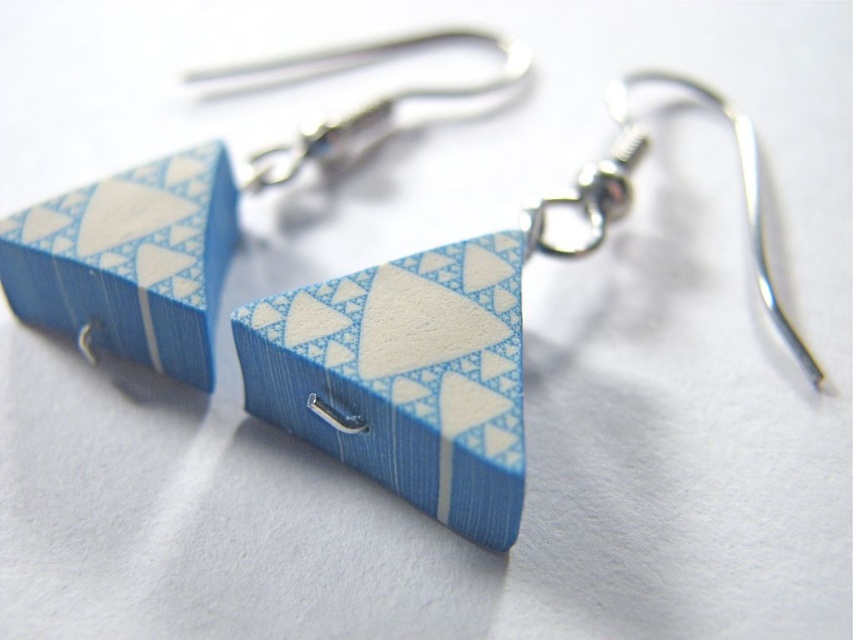
Is matte blue wood triangle at center bigger than blue paper triangle at center?

Indeed, matte blue wood triangle at center has a larger size compared to blue paper triangle at center.

Does matte blue wood triangle at center have a lesser height compared to blue paper triangle at center?

In fact, matte blue wood triangle at center may be taller than blue paper triangle at center.

Between point (474, 269) and point (428, 392), which one is positioned behind?

Point (474, 269)

Locate an element on the screen. This screenshot has width=853, height=640. matte blue wood triangle at center is located at coordinates (447, 348).

Which is more to the right, matte blue wood triangle at center or silver metallic hook at upper center?

matte blue wood triangle at center is more to the right.

Does point (283, 314) lie in front of point (291, 154)?

Yes, point (283, 314) is in front of point (291, 154).

You are a GUI agent. You are given a task and a screenshot of the screen. Output one action in this format:
    pyautogui.click(x=<x>, y=<y>)
    Task: Click on the matte blue wood triangle at center
    The width and height of the screenshot is (853, 640).
    Given the screenshot: What is the action you would take?
    pyautogui.click(x=447, y=348)

Does blue paper triangle at center appear under silver metallic hook at upper center?

Indeed, blue paper triangle at center is positioned under silver metallic hook at upper center.

Is blue paper triangle at center to the right of silver metallic hook at upper center from the viewer's perspective?

Yes, blue paper triangle at center is to the right of silver metallic hook at upper center.

Is point (521, 397) positioned in front of point (213, 68)?

Yes.

Find the location of `blue paper triangle at center`. blue paper triangle at center is located at coordinates (405, 378).